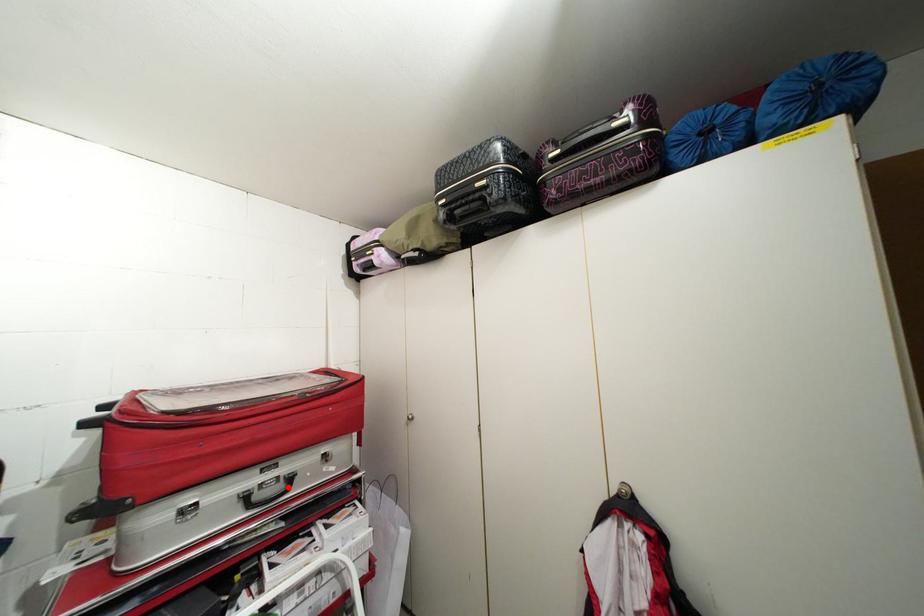
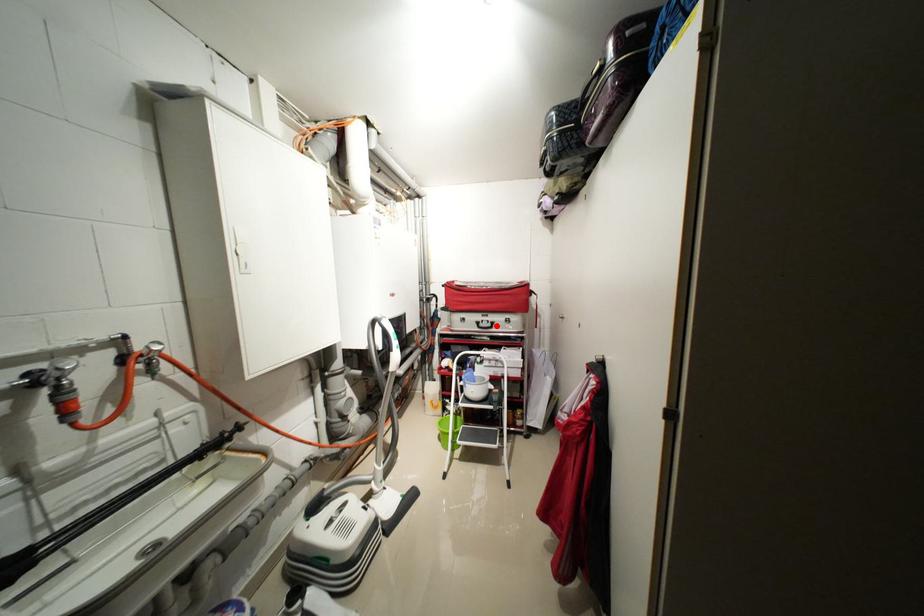
I am providing you with two images of the same scene from different viewpoints. A red point is marked on the first image and another point is marked on the second image. Does the point marked in image1 correspond to the same location as the one in image2?

Yes